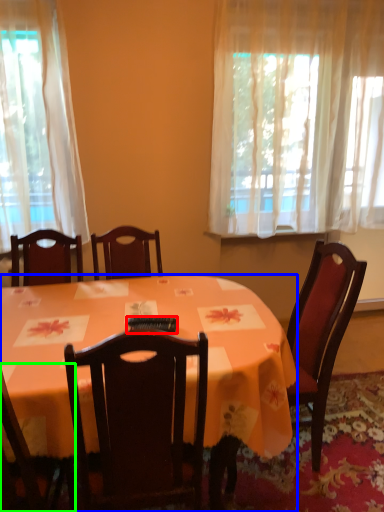
Question: Based on their relative distances, which object is farther from remote control (highlighted by a red box)? Choose from desk (highlighted by a blue box) and chair (highlighted by a green box).

Choices:
 (A) desk
 (B) chair

Answer: (A)